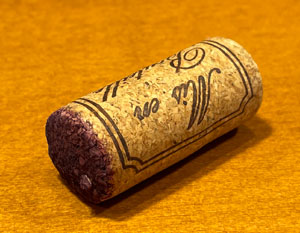
At what (x,y) coordinates should I click in order to perform the action: click on bottom cork. Please return your answer as a coordinate pair (x, y). Image resolution: width=300 pixels, height=233 pixels. Looking at the image, I should click on (242, 56).